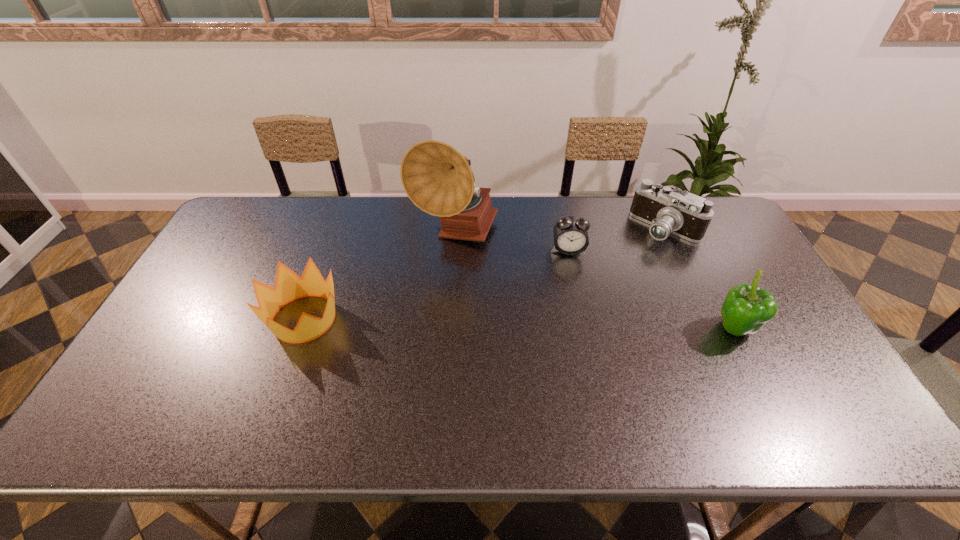
Find the location of a particular element. free space between the camera and the third object from left to right is located at coordinates (617, 239).

Identify the location of vacant area that lies between the leftmost object and the camera. (485, 274).

You are a GUI agent. You are given a task and a screenshot of the screen. Output one action in this format:
    pyautogui.click(x=<x>, y=<y>)
    Task: Click on the empty location between the camera and the crown
    The width and height of the screenshot is (960, 540).
    Given the screenshot: What is the action you would take?
    pyautogui.click(x=485, y=274)

Find the location of a particular element. The image size is (960, 540). vacant area that lies between the tallest object and the fourth shortest object is located at coordinates (594, 282).

Select which object appears as the second closest to the third object from right to left. Please provide its 2D coordinates. Your answer should be formatted as a tuple, i.e. [(x, y)], where the tuple contains the x and y coordinates of a point satisfying the conditions above.

[(686, 215)]

Locate an element on the screen. object that stands as the closest to the alarm clock is located at coordinates (435, 176).

Where is `vacant position in the image that satisfies the following two spatial constraints: 1. on the front side of the tallest object; 2. on the right side of the bell pepper`? The height and width of the screenshot is (540, 960). vacant position in the image that satisfies the following two spatial constraints: 1. on the front side of the tallest object; 2. on the right side of the bell pepper is located at coordinates (449, 329).

I want to click on blank area in the image that satisfies the following two spatial constraints: 1. on the back side of the crown; 2. on the right side of the tallest object, so click(335, 234).

Find the location of a particular element. The image size is (960, 540). blank space that satisfies the following two spatial constraints: 1. on the front side of the second object from left to right; 2. on the right side of the fourth shortest object is located at coordinates click(x=449, y=329).